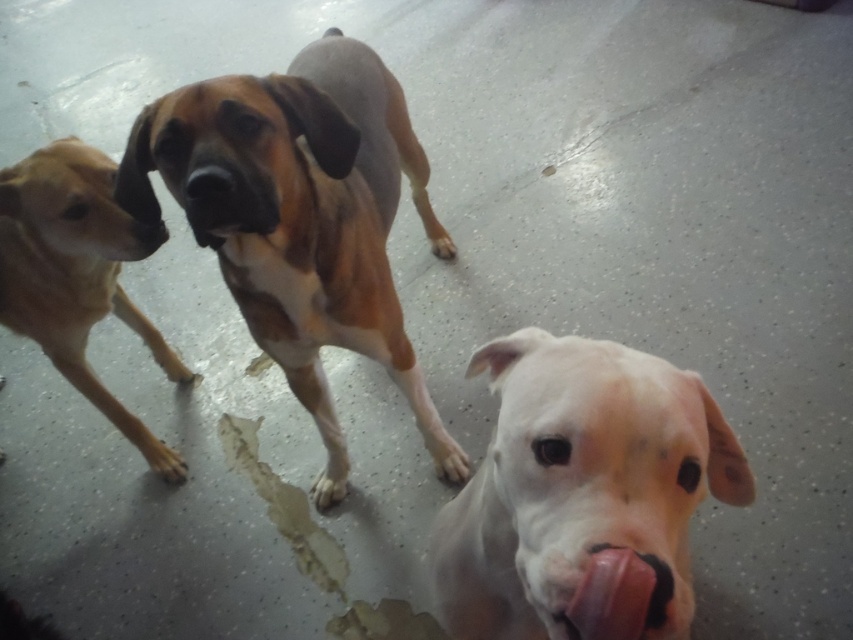
Who is taller, brown/white fur dog at center or brown matte nose at center?

brown/white fur dog at center is taller.

Is brown/white fur dog at center further to the viewer compared to brown matte nose at center?

No.

Does point (386, 182) come farther from viewer compared to point (137, 237)?

Yes, point (386, 182) is behind point (137, 237).

Locate an element on the screen. The height and width of the screenshot is (640, 853). brown/white fur dog at center is located at coordinates (303, 220).

Between white matte dog at center and pink rubber toy at lower center, which one appears on the left side from the viewer's perspective?

pink rubber toy at lower center

Is point (666, 525) in front of point (650, 592)?

No, it is not.

Who is more distant from viewer, (682,420) or (641,579)?

The point (682,420) is more distant.

Find the location of a particular element. white matte dog at center is located at coordinates (582, 493).

Can you confirm if brown smooth dog at left is bigger than pink rubber toy at lower center?

Yes, brown smooth dog at left is bigger than pink rubber toy at lower center.

Consider the image. Can you confirm if brown smooth dog at left is smaller than pink rubber toy at lower center?

No.

Identify the location of brown smooth dog at left. This screenshot has width=853, height=640. (74, 275).

This screenshot has width=853, height=640. In order to click on brown smooth dog at left in this screenshot , I will do `click(74, 275)`.